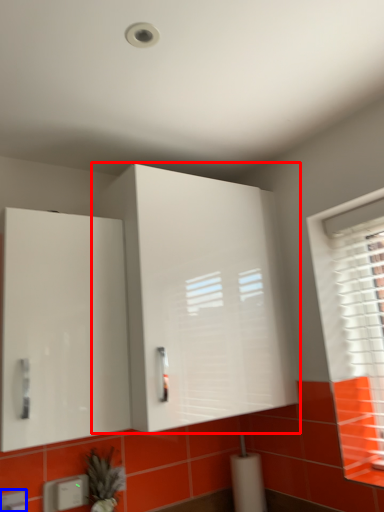
Question: Which point is further to the camera, cabinetry (highlighted by a red box) or electric outlet (highlighted by a blue box)?

Choices:
 (A) cabinetry
 (B) electric outlet

Answer: (B)